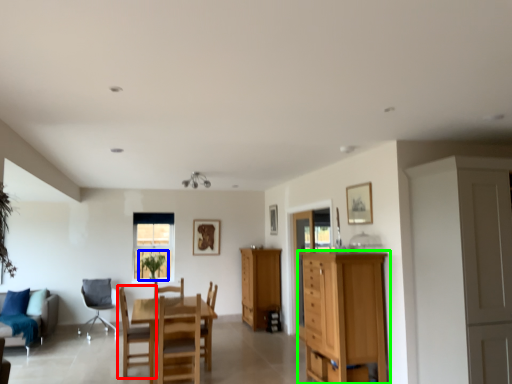
Question: Estimate the real-world distances between objects in this image. Which object is farther from chair (highlighted by a red box), plant (highlighted by a blue box) or chest of drawers (highlighted by a green box)?

Choices:
 (A) plant
 (B) chest of drawers

Answer: (A)